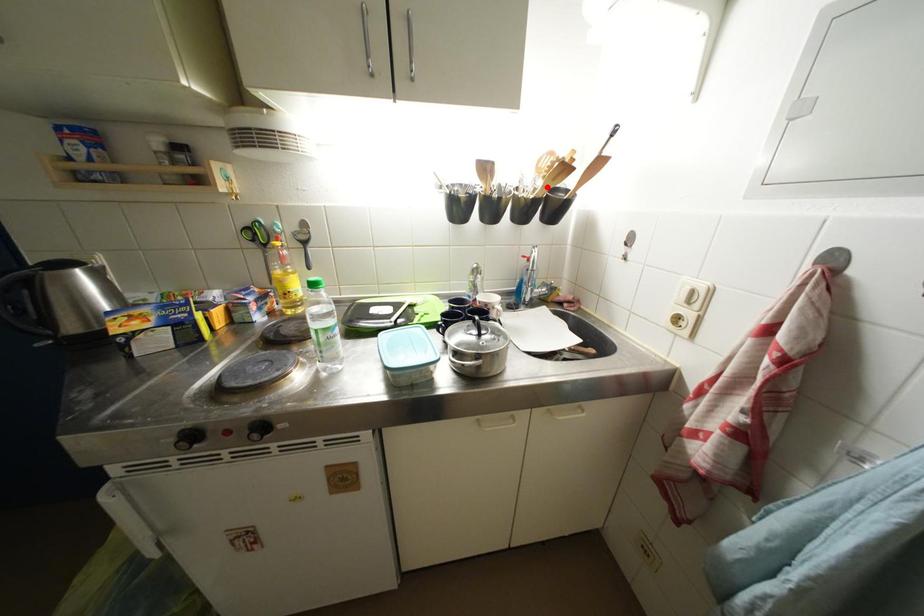
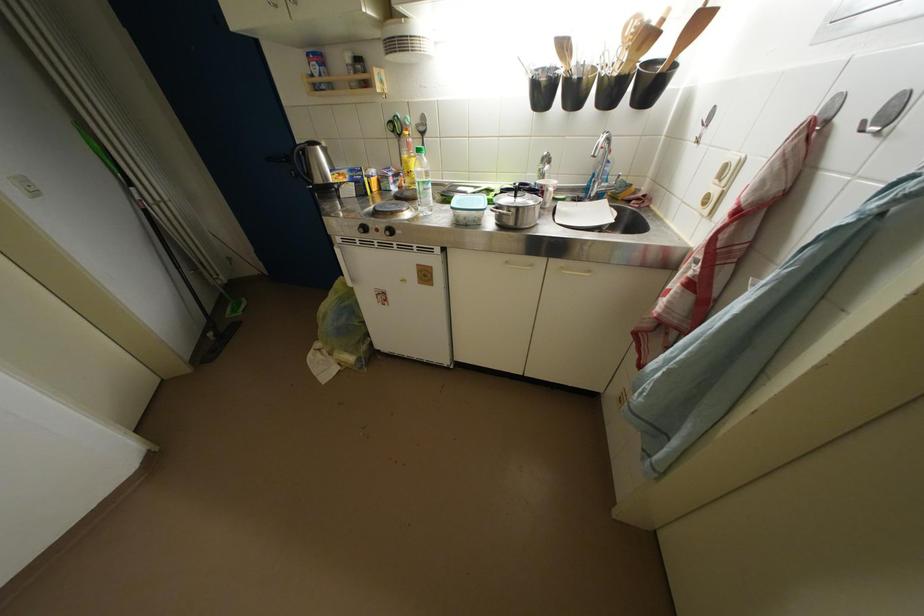
In the second image, find the point that corresponds to the highlighted location in the first image.

(631, 60)